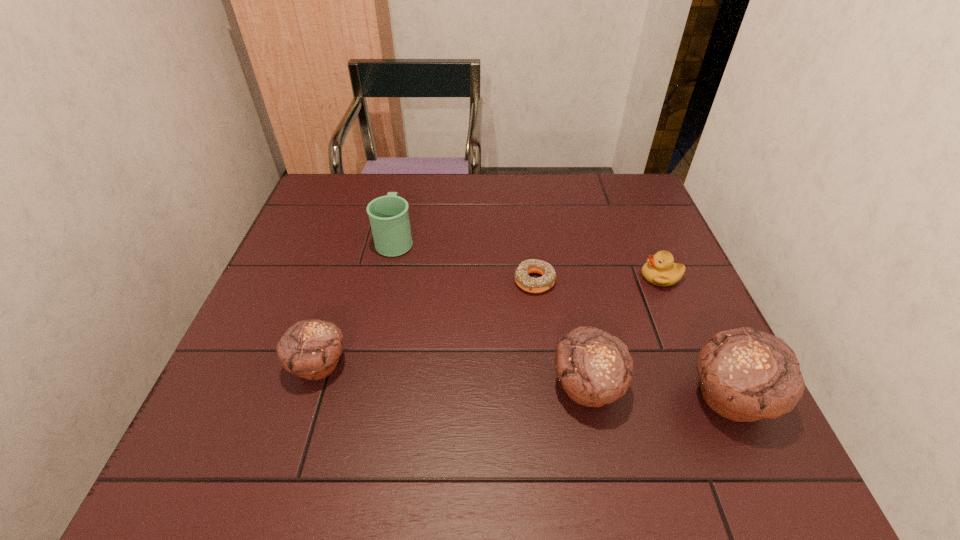
This screenshot has width=960, height=540. In order to click on the fourth tallest object in this screenshot , I will do `click(311, 349)`.

Identify the location of the leftmost muffin. The image size is (960, 540). (311, 349).

Locate an element on the screen. the second tallest muffin is located at coordinates (595, 368).

The height and width of the screenshot is (540, 960). Find the location of `the rightmost muffin`. the rightmost muffin is located at coordinates (745, 374).

The width and height of the screenshot is (960, 540). Find the location of `the farthest object`. the farthest object is located at coordinates (389, 218).

Find the location of `doughnut`. doughnut is located at coordinates (530, 284).

The height and width of the screenshot is (540, 960). In order to click on the second shortest object in this screenshot , I will do `click(660, 269)`.

Identify the location of vacant region located 0.310m on the right of the third shortest object. (496, 365).

The width and height of the screenshot is (960, 540). I want to click on free location located 0.310m on the left of the second tallest muffin, so click(x=396, y=386).

You are a GUI agent. You are given a task and a screenshot of the screen. Output one action in this format:
    pyautogui.click(x=<x>, y=<y>)
    Task: Click on the free space located 0.210m on the back of the rightmost muffin
    
    Given the screenshot: What is the action you would take?
    pyautogui.click(x=682, y=291)